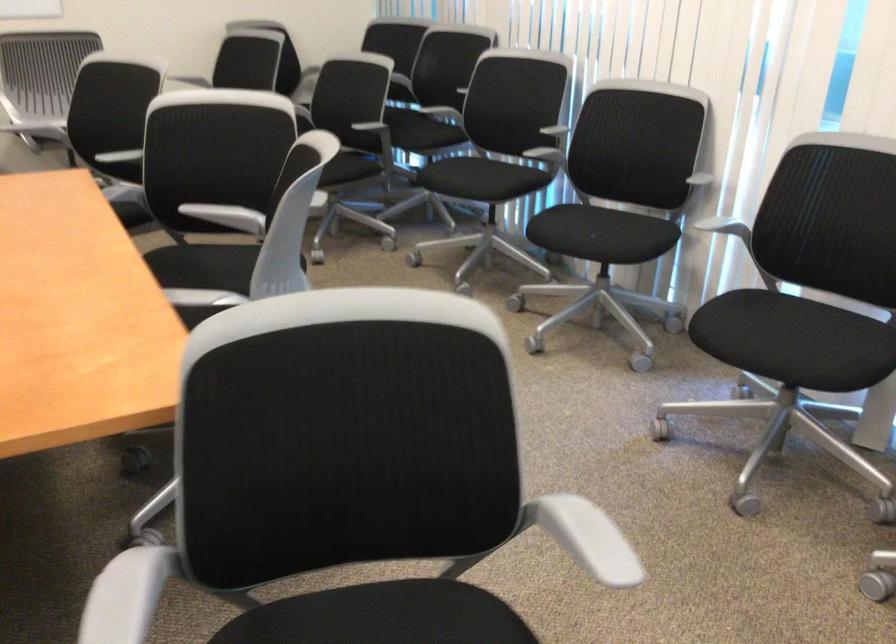
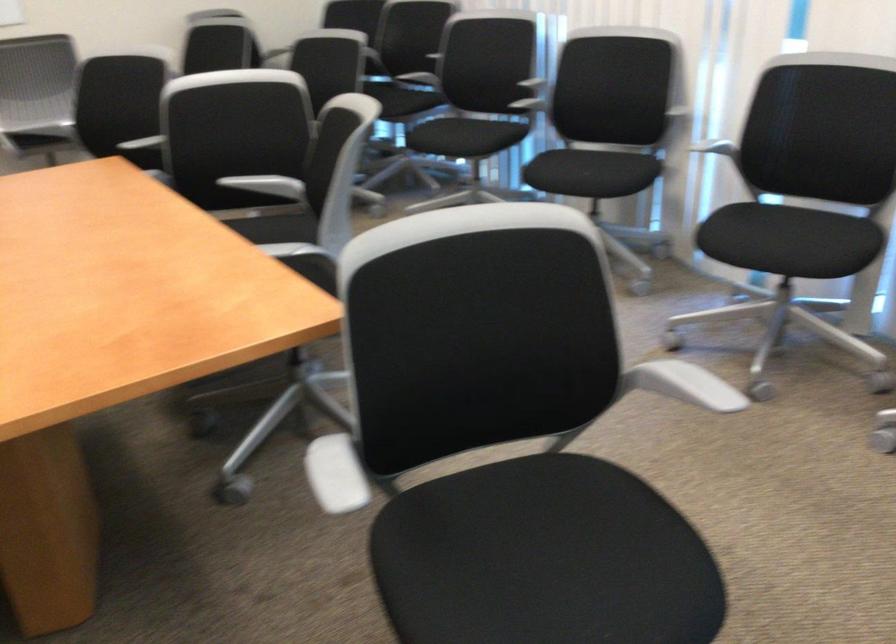
Where in the second image is the point corresponding to (x=591, y=538) from the first image?

(682, 384)